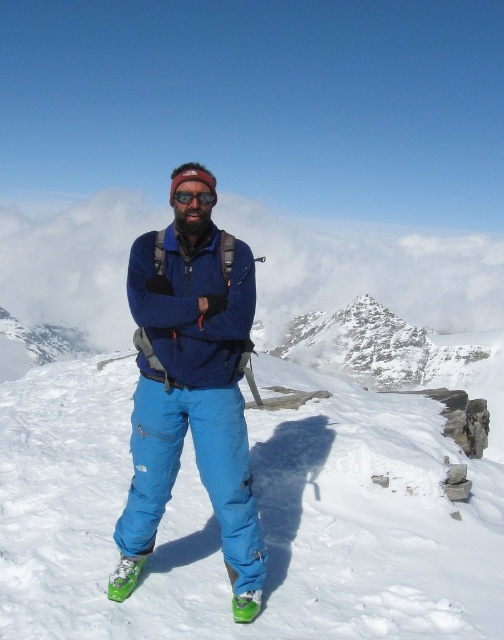
Question: Estimate the real-world distances between objects in this image. Which object is farther from the blue fabric pants at center?

Choices:
 (A) white fluffy cloud at upper center
 (B) black matte goggles at center
 (C) blue fabric ski slope at center

Answer: (A)

Question: Estimate the real-world distances between objects in this image. Which object is closer to the white fluffy cloud at upper center?

Choices:
 (A) blue fabric ski slope at center
 (B) black matte goggles at center
 (C) blue fabric pants at center

Answer: (A)

Question: Is the position of blue fabric ski slope at center more distant than that of black matte goggles at center?

Choices:
 (A) no
 (B) yes

Answer: (A)

Question: Can you confirm if white fluffy cloud at upper center is positioned above blue fabric pants at center?

Choices:
 (A) no
 (B) yes

Answer: (B)

Question: Is white fluffy cloud at upper center above black matte goggles at center?

Choices:
 (A) yes
 (B) no

Answer: (A)

Question: Which point is closer to the camera?

Choices:
 (A) (305, 525)
 (B) (266, 314)

Answer: (A)